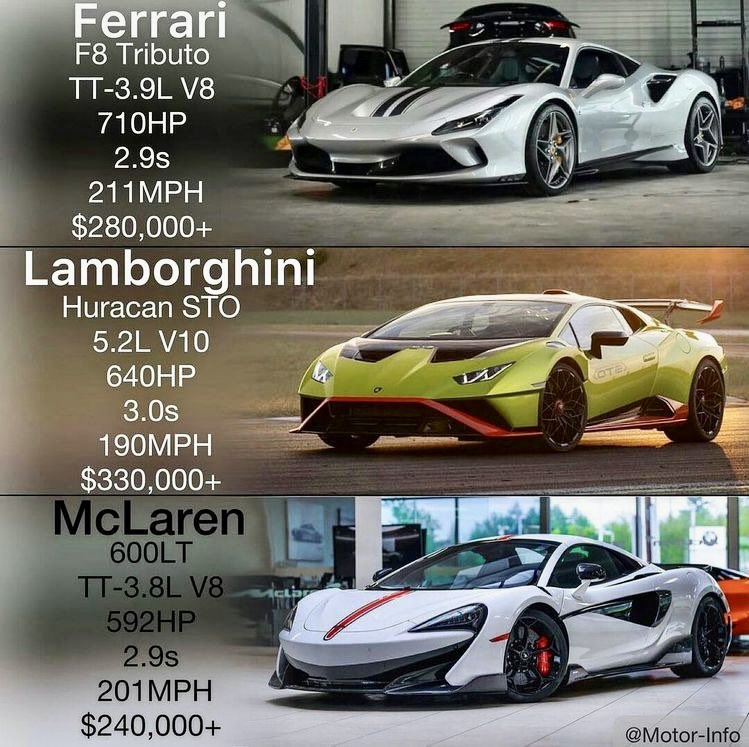
I want to click on dealership tile floor, so click(x=592, y=725).